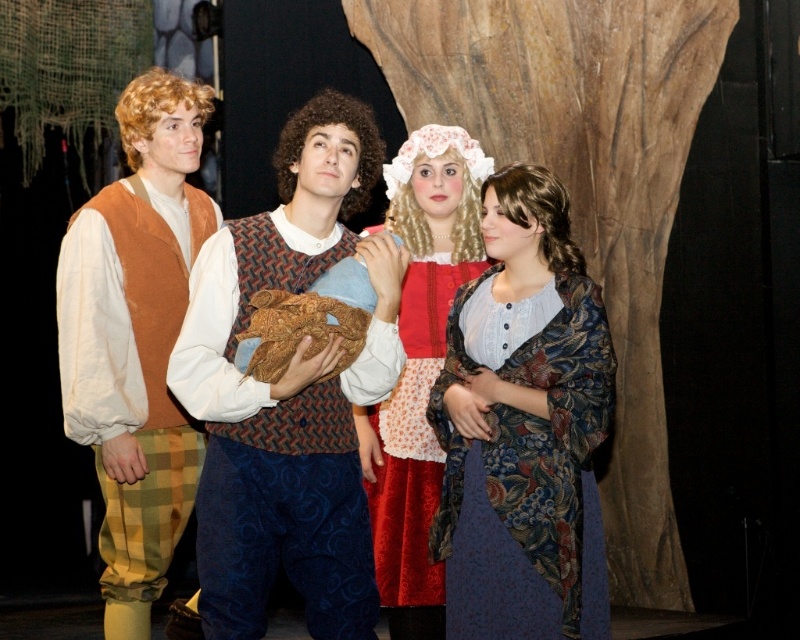
You are designing a stage layout and need to place a 1.2 meter wide prop between the matte brown vest at left and the velvet red dress at center. Given the width difference between the two, will the prop fit between them?

The matte brown vest at left is wider than the velvet red dress at center. Since the prop is 1.2 meters wide, it depends on the actual distance between them. However, the description only mentions their widths, not the space between. Without knowing the exact spacing, we cannot confirm if the prop will fit.

You are standing at point [173,330] and want to take a photo of the entire stage. The camera you have can capture a maximum distance of 4 meters. Will you be able to capture the entire stage in one shot?

The distance between point [173,330] and the camera is 4.38 meters, which exceeds the camera maximum capture distance of 4 meters. Therefore, you will not be able to capture the entire stage in one shot.

You are a costume designer observing the scene. The floral brocade shawl at center and the velvet red dress at center are both part of a character ensemble. Which item is placed lower on the character?

The floral brocade shawl at center is positioned under the velvet red dress at center, so it is placed lower on the character.